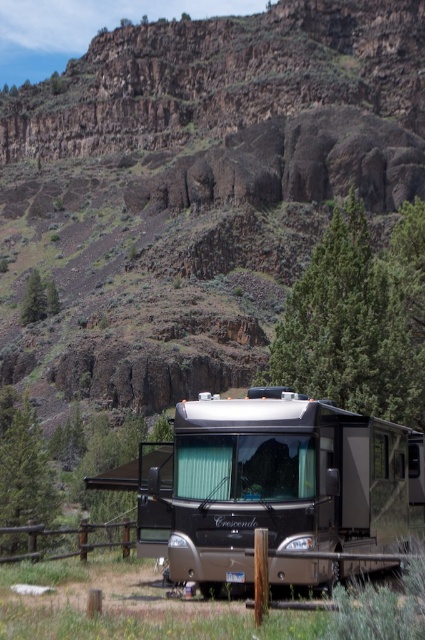
How much distance is there between rugged rock hillside at upper center and green textured tree at center?

They are 77.32 feet apart.

Is rugged rock hillside at upper center to the left of green textured tree at center from the viewer's perspective?

Correct, you'll find rugged rock hillside at upper center to the left of green textured tree at center.

Which is behind, point (155, 22) or point (410, 244)?

Point (155, 22)

Locate an element on the screen. rugged rock hillside at upper center is located at coordinates (195, 189).

Can you confirm if metallic silver rv at center is shorter than green pine tree at left?

Incorrect, metallic silver rv at center's height does not fall short of green pine tree at left's.

Is metallic silver rv at center to the right of green pine tree at left from the viewer's perspective?

Indeed, metallic silver rv at center is positioned on the right side of green pine tree at left.

Find the location of `metallic silver rv at center`. metallic silver rv at center is located at coordinates (277, 483).

Locate an element on the screen. The image size is (425, 640). green textured tree at center is located at coordinates (359, 317).

Can you confirm if green textured tree at center is wider than green pine tree at left?

Yes.

Where is `green textured tree at center`? This screenshot has width=425, height=640. green textured tree at center is located at coordinates (359, 317).